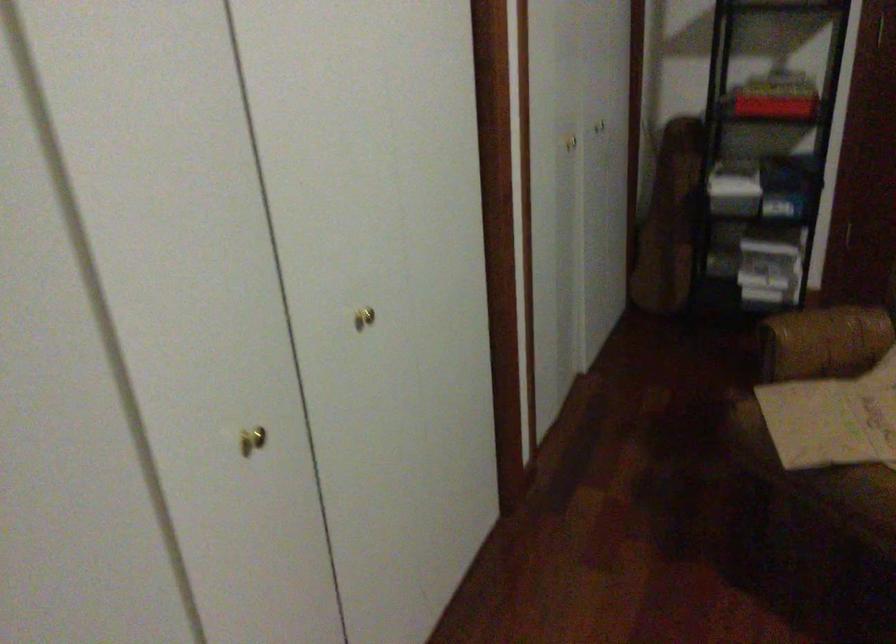
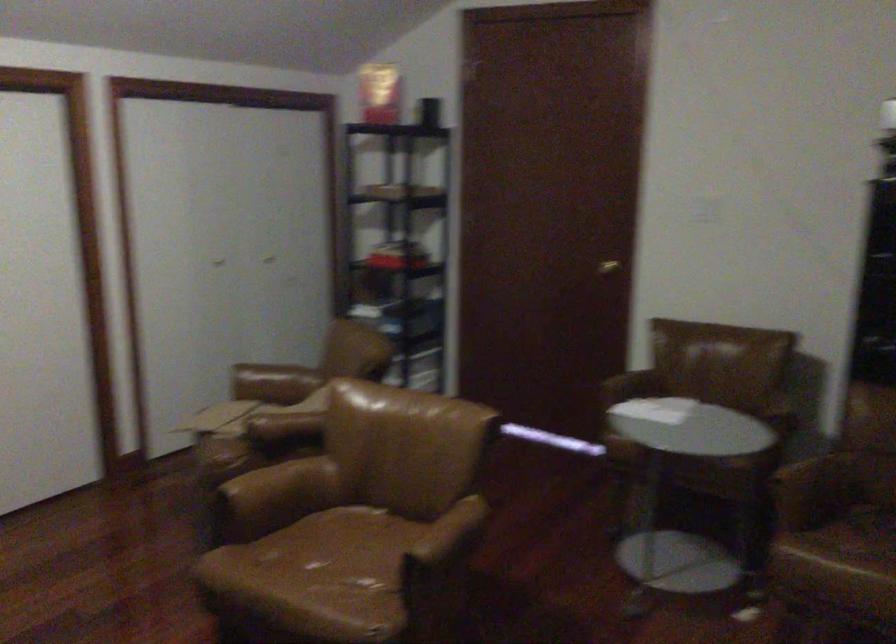
Where in the second image is the point corresponding to point 800,344 from the first image?

(273, 383)